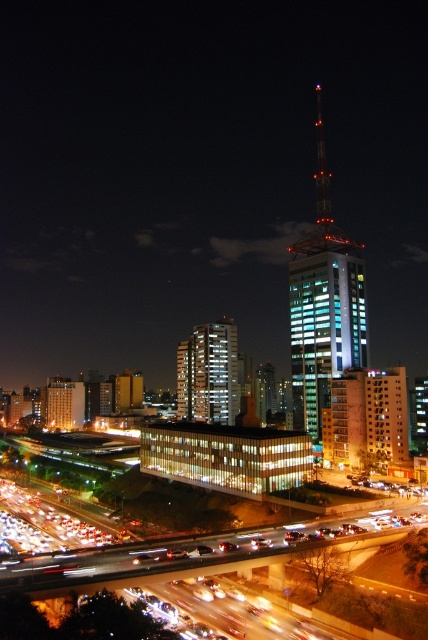
Who is positioned more to the right, blue glass tower at center or metallic silver highway at bottom left?

blue glass tower at center is more to the right.

Is point (329, 241) behind point (131, 545)?

Yes.

Which is behind, point (294, 404) or point (303, 545)?

The point (294, 404) is more distant.

You are a GUI agent. You are given a task and a screenshot of the screen. Output one action in this format:
    pyautogui.click(x=<x>, y=<y>)
    Task: Click on the blue glass tower at center
    This screenshot has height=640, width=428.
    Given the screenshot: What is the action you would take?
    pyautogui.click(x=323, y=305)

Can you confirm if blue glass tower at center is shorter than white glass building at center?

No.

How far apart are blue glass tower at center and white glass building at center?

A distance of 82.43 meters exists between blue glass tower at center and white glass building at center.

At what (x,y) coordinates should I click in order to perform the action: click on blue glass tower at center. Please return your answer as a coordinate pair (x, y). Looking at the image, I should click on (323, 305).

Find the location of `blue glass tower at center`. blue glass tower at center is located at coordinates click(x=323, y=305).

Who is more forward, (142, 570) or (238, 404)?

Point (142, 570) is in front.

Looking at this image, who is positioned more to the left, metallic silver highway at bottom left or white glass building at center?

white glass building at center

Where is `metallic silver highway at bottom left`? This screenshot has height=640, width=428. metallic silver highway at bottom left is located at coordinates point(171,561).